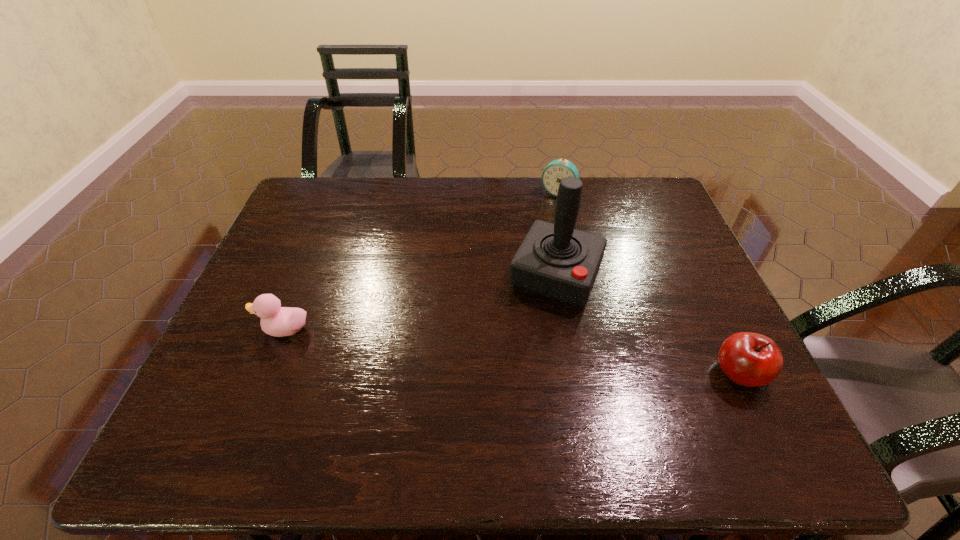
Image resolution: width=960 pixels, height=540 pixels. What are the coordinates of `free space at the near edge of the desktop` in the screenshot? It's located at (564, 408).

You are a GUI agent. You are given a task and a screenshot of the screen. Output one action in this format:
    pyautogui.click(x=<x>, y=<y>)
    Task: Click on the vacant space at the left edge of the desktop
    The height and width of the screenshot is (540, 960).
    Given the screenshot: What is the action you would take?
    pyautogui.click(x=268, y=342)

In the image, there is a desktop. What are the coordinates of `vacant region at the right edge` in the screenshot? It's located at (690, 276).

You are a GUI agent. You are given a task and a screenshot of the screen. Output one action in this format:
    pyautogui.click(x=<x>, y=<y>)
    Task: Click on the vacant region at the far left corner of the desktop
    The width and height of the screenshot is (960, 540).
    Given the screenshot: What is the action you would take?
    pyautogui.click(x=324, y=197)

Identify the location of free region at the far right corner. This screenshot has width=960, height=540. (644, 215).

In the image, there is a desktop. At what (x,y) coordinates should I click in order to perform the action: click on blank space at the near right corner. Please return your answer as a coordinate pair (x, y). Looking at the image, I should click on (739, 387).

At what (x,y) coordinates should I click in order to perform the action: click on unoccupied area between the rightmost object and the tallest object. Please return your answer as a coordinate pair (x, y). This screenshot has height=540, width=960. Looking at the image, I should click on (648, 324).

Find the location of a particular element. free point between the alarm clock and the shortest object is located at coordinates (420, 261).

Locate an element on the screen. This screenshot has width=960, height=540. free space between the second farthest object and the leftmost object is located at coordinates (420, 302).

Image resolution: width=960 pixels, height=540 pixels. Find the location of `unoccupied area between the tallest object and the apple`. unoccupied area between the tallest object and the apple is located at coordinates (648, 324).